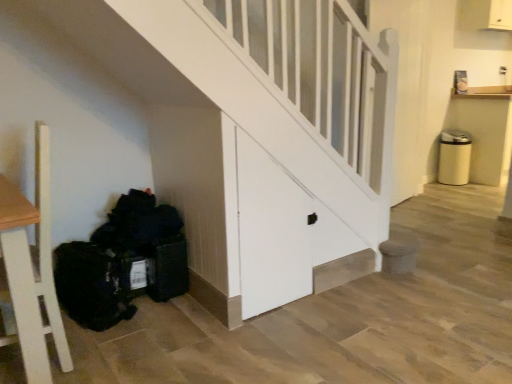
Question: Considering the relative sizes of white wood door at center and black fabric bag at lower left in the image provided, is white wood door at center shorter than black fabric bag at lower left?

Choices:
 (A) no
 (B) yes

Answer: (A)

Question: Is white wood door at center positioned with its back to black fabric bag at lower left?

Choices:
 (A) no
 (B) yes

Answer: (A)

Question: Is the position of white wood door at center less distant than that of black fabric bag at lower left?

Choices:
 (A) yes
 (B) no

Answer: (A)

Question: Is black fabric bag at lower left located within white wood door at center?

Choices:
 (A) no
 (B) yes

Answer: (A)

Question: From the image's perspective, is white wood door at center located beneath black fabric bag at lower left?

Choices:
 (A) yes
 (B) no

Answer: (B)

Question: From the image's perspective, would you say white wood door at center is positioned over black fabric bag at lower left?

Choices:
 (A) yes
 (B) no

Answer: (A)

Question: Is black fabric bag at lower left located outside white wood door at center?

Choices:
 (A) yes
 (B) no

Answer: (A)

Question: Does black fabric bag at lower left appear on the right side of white wood door at center?

Choices:
 (A) yes
 (B) no

Answer: (B)

Question: Does black fabric bag at lower left lie in front of white wood door at center?

Choices:
 (A) no
 (B) yes

Answer: (A)

Question: Is black fabric bag at lower left facing towards white wood door at center?

Choices:
 (A) no
 (B) yes

Answer: (A)

Question: Is black fabric bag at lower left next to white wood door at center and touching it?

Choices:
 (A) yes
 (B) no

Answer: (B)

Question: Can you confirm if black fabric bag at lower left is taller than white wood door at center?

Choices:
 (A) yes
 (B) no

Answer: (B)

Question: From the image's perspective, is black fabric bag at lower left positioned above or below white wood door at center?

Choices:
 (A) above
 (B) below

Answer: (B)